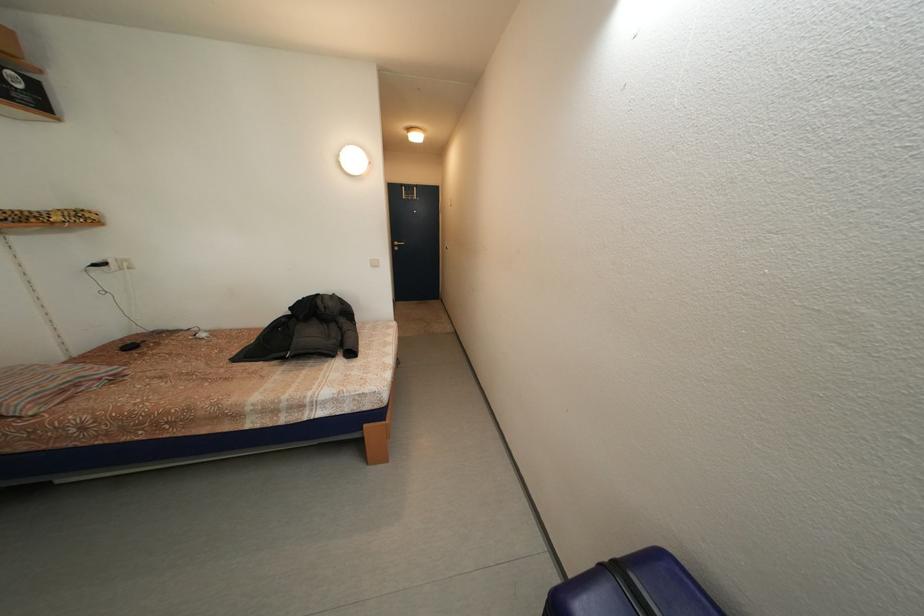
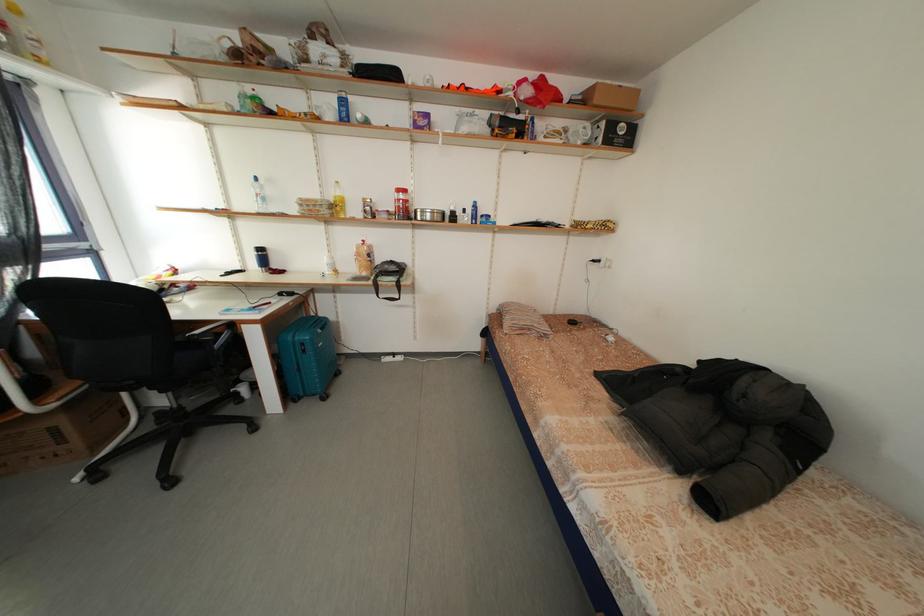
First-person continuous shooting, in which direction is the camera rotating?

The camera rotated toward left-down.